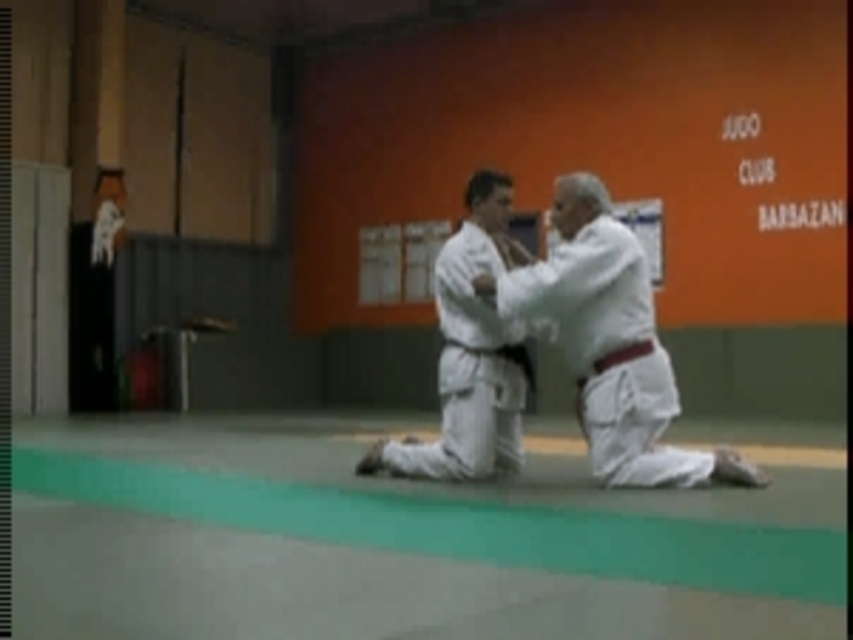
Does white cloth kimono at center have a lesser height compared to white matte kimono at center?

Indeed, white cloth kimono at center has a lesser height compared to white matte kimono at center.

Is white cloth kimono at center behind white matte kimono at center?

No, it is not.

Who is more forward, (606,372) or (451,384)?

Positioned in front is point (606,372).

The height and width of the screenshot is (640, 853). Identify the location of white cloth kimono at center. (608, 340).